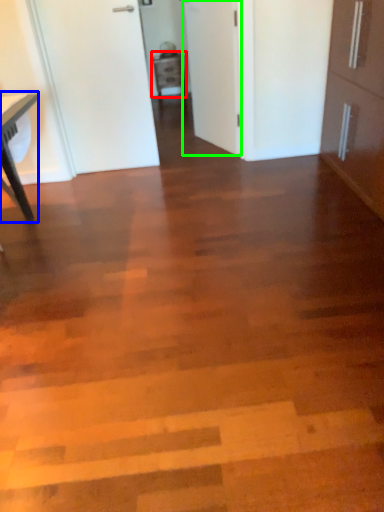
Question: Based on their relative distances, which object is farther from cabinetry (highlighted by a red box)? Choose from table (highlighted by a blue box) and door (highlighted by a green box).

Choices:
 (A) table
 (B) door

Answer: (A)